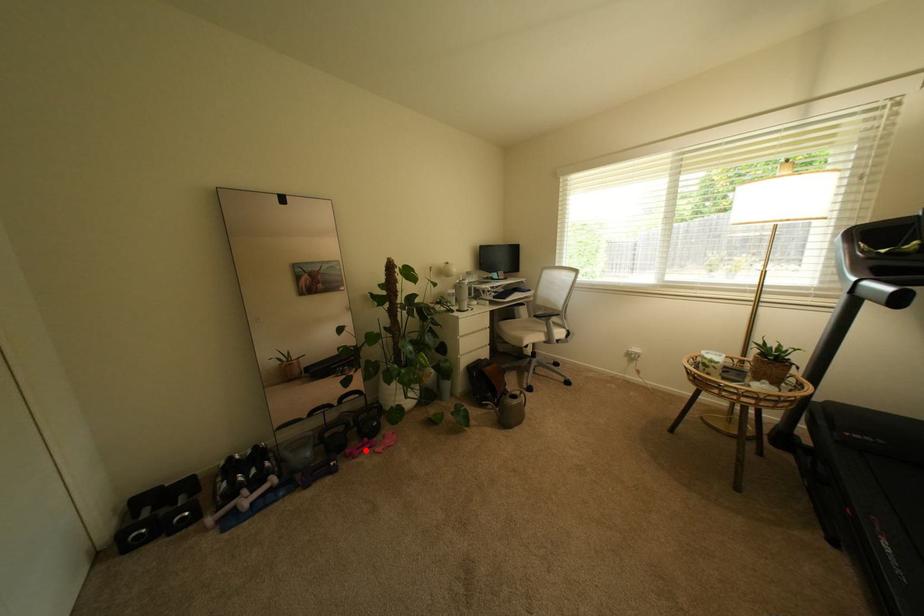
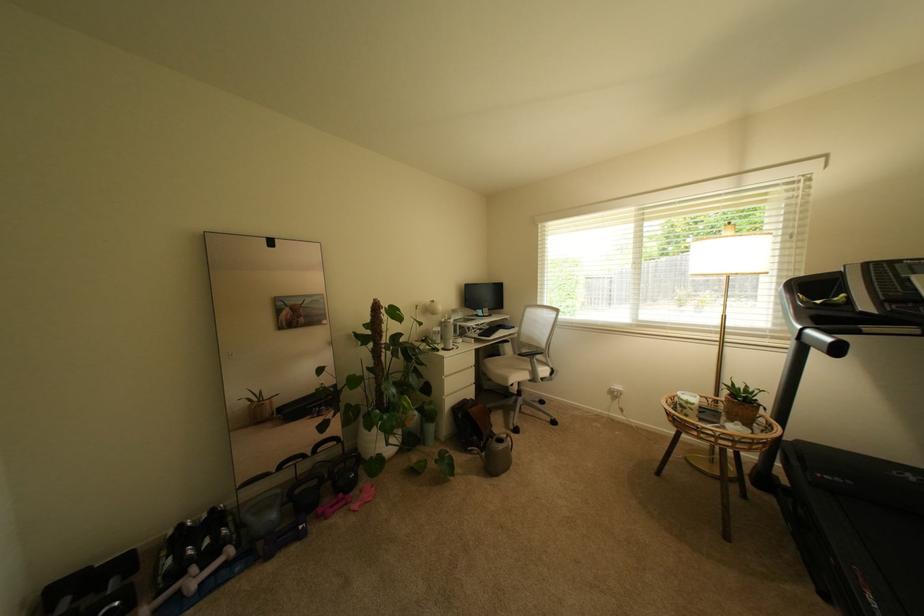
In the second image, find the point that corresponds to the highlighted location in the first image.

(339, 508)